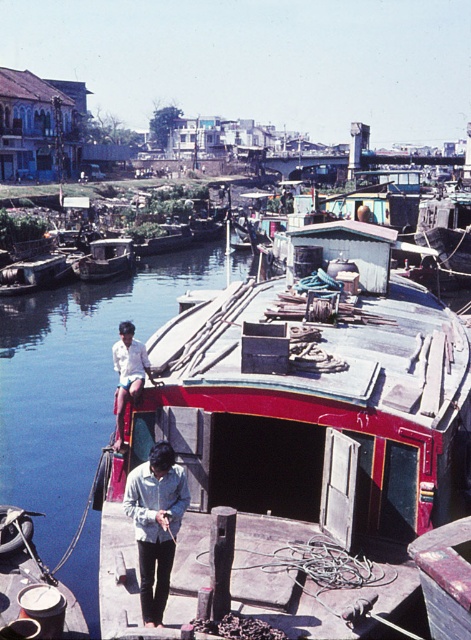
You are a photographer planning to take a photo of both the metallic gray boat at center and the wooden boat at center. Since you want them to appear side by side in your frame, which boat should you position to the left to ensure they are aligned properly?

The metallic gray boat at center is positioned on the right side of wooden boat at center, so to have them appear side by side with the metallic gray boat on the right and the wooden boat on the left in the photo, you should position the wooden boat at center to the left.

You are standing on the riverside and want to board the red painted wood boat at center. The minimum safe distance for a small boat ramp is 5 meters. Can you safely board using the ramp?

The red painted wood boat at center is 6.81 meters away from the viewer. Since the minimum safe distance for a small boat ramp is 5 meters, the distance is sufficient, so yes, you can safely board using the ramp.

You are a photographer standing on the dock and want to take a photo of the red painted wood boat at center and the light blue denim shirt at center. Which object should you focus on first to ensure both are in the frame?

You should focus on the red painted wood boat at center first because it is positioned over the light blue denim shirt at center, meaning the boat is closer to you and the shirt is behind it. By focusing on the boat, both objects will be in the frame as the shirt is behind the boat.